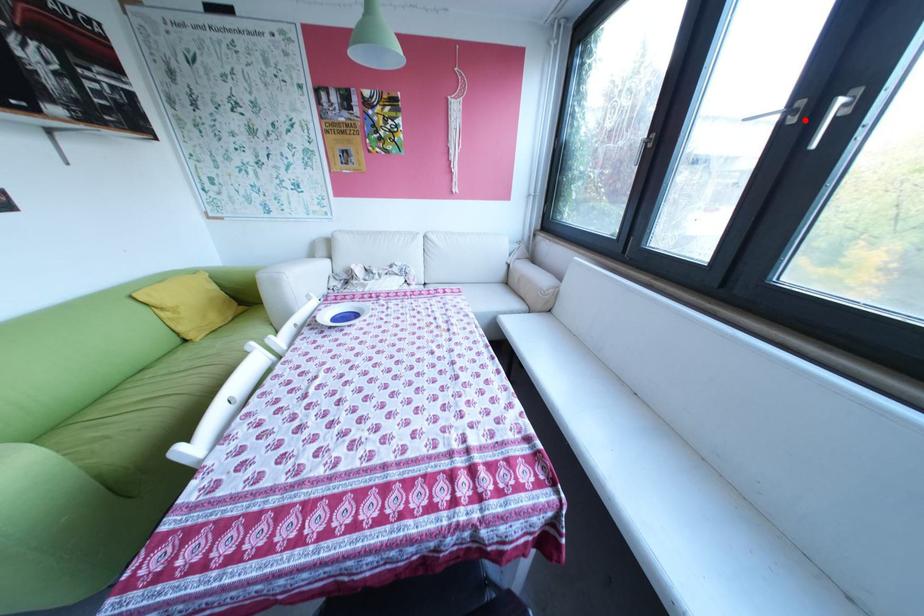
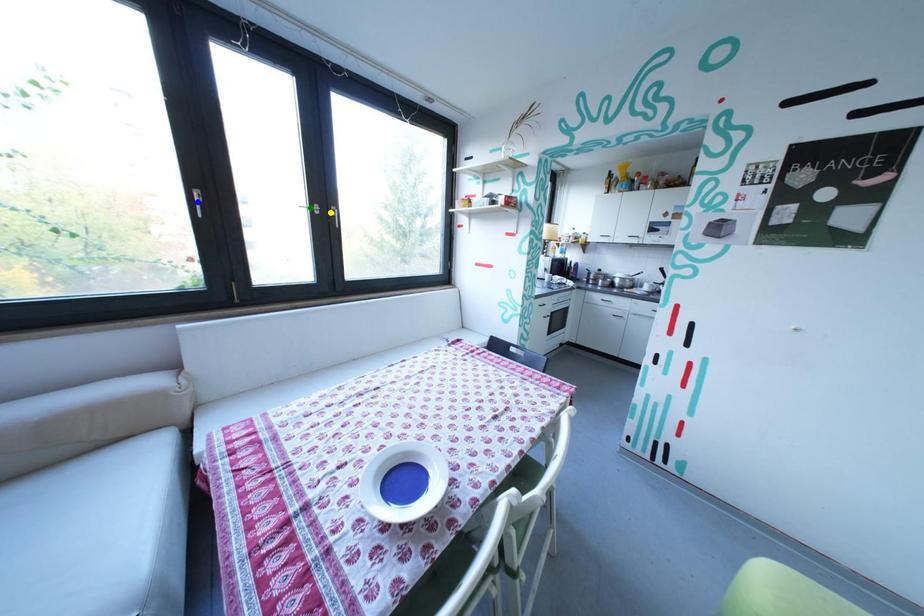
Question: I am providing you with two images of the same scene from different viewpoints. A red point is marked on the first image. You are given multiple points on the second image. Which point in image 2 is actually the same real-world point as the red point in image 1?

Choices:
 (A) green point
 (B) yellow point
 (C) blue point

Answer: (B)